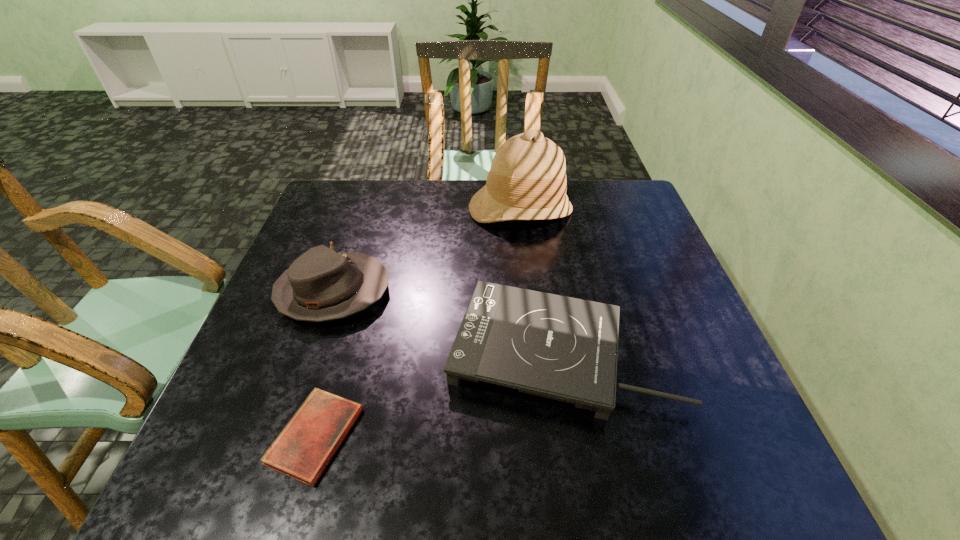
Locate an element on the screen. object positioned at the far edge is located at coordinates (527, 181).

I want to click on object that is at the near edge, so click(x=303, y=449).

In order to click on hat that is at the left edge in this screenshot , I will do `click(320, 285)`.

The width and height of the screenshot is (960, 540). Find the location of `diary that is at the left edge`. diary that is at the left edge is located at coordinates (303, 449).

Image resolution: width=960 pixels, height=540 pixels. What are the coordinates of `object present at the right edge` in the screenshot? It's located at (562, 348).

This screenshot has height=540, width=960. I want to click on object present at the near left corner, so click(303, 449).

Locate an element on the screen. The image size is (960, 540). vacant space at the far edge of the desktop is located at coordinates (416, 216).

In order to click on vacant space at the near edge in this screenshot , I will do `click(684, 492)`.

In the image, there is a desktop. Find the location of `vacant space at the left edge`. vacant space at the left edge is located at coordinates (300, 375).

Identify the location of vacant space at the right edge of the desktop. The image size is (960, 540). (618, 237).